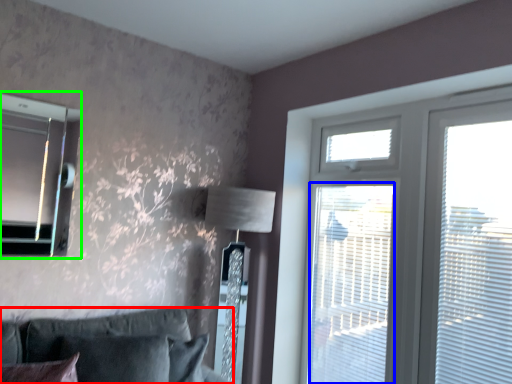
Question: Estimate the real-world distances between objects in this image. Which object is farther from studio couch (highlighted by a red box), screen door (highlighted by a blue box) or bay window (highlighted by a green box)?

Choices:
 (A) screen door
 (B) bay window

Answer: (A)